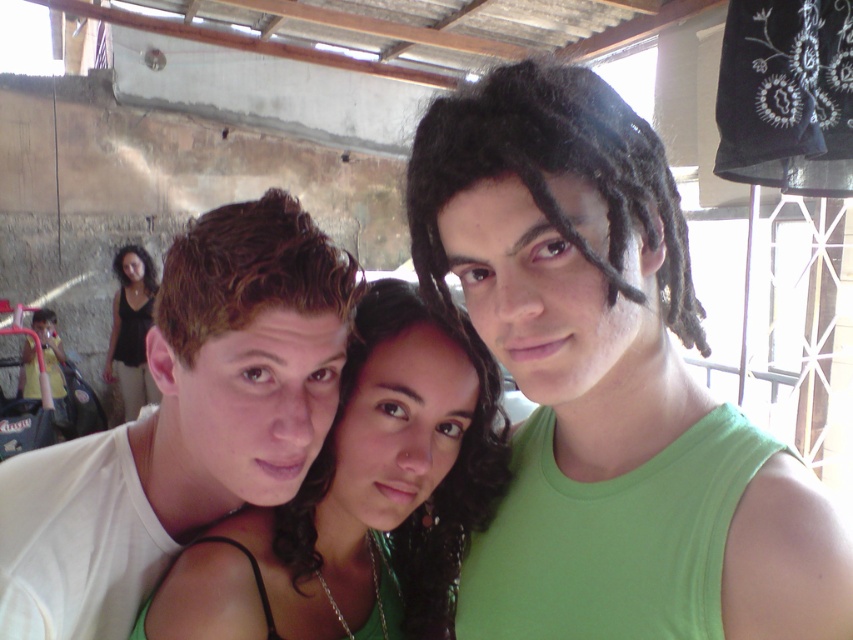
Question: Estimate the real-world distances between objects in this image. Which object is closer to the shiny green dress at center?

Choices:
 (A) black fabric at left
 (B) green matte tank top at center
 (C) white matte t-shirt at left

Answer: (C)

Question: Among these objects, which one is nearest to the camera?

Choices:
 (A) shiny green dress at center
 (B) white matte t-shirt at left
 (C) black fabric at left
 (D) green matte tank top at center

Answer: (D)

Question: Is green matte tank top at center thinner than black fabric at left?

Choices:
 (A) no
 (B) yes

Answer: (B)

Question: Which point is farther from the camera taking this photo?

Choices:
 (A) (144, 252)
 (B) (251, 228)
 (C) (538, 218)
 (D) (279, 620)

Answer: (A)

Question: Observing the image, what is the correct spatial positioning of white matte t-shirt at left in reference to shiny green dress at center?

Choices:
 (A) above
 (B) below

Answer: (A)

Question: Can you confirm if shiny green dress at center is positioned below black fabric at left?

Choices:
 (A) no
 (B) yes

Answer: (B)